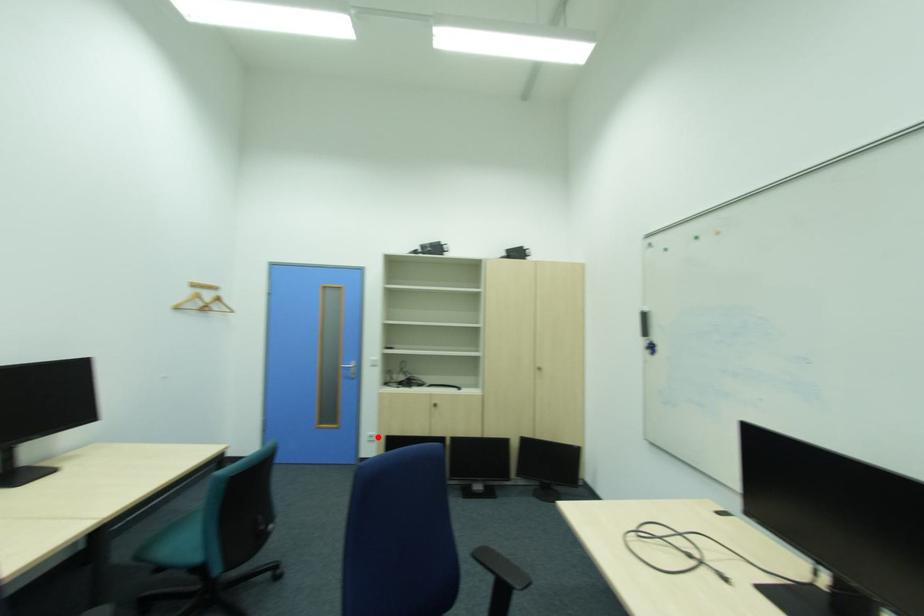
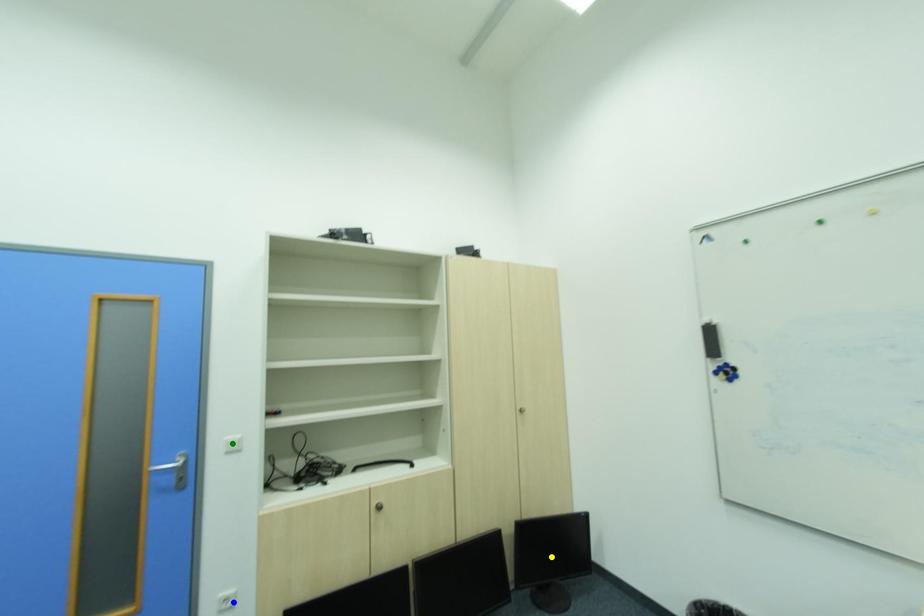
Question: I am providing you with two images of the same scene from different viewpoints. A red point is marked on the first image. You are given multiple points on the second image. Can you choose the point in image 2 that corresponds to the point in image 1?

Choices:
 (A) blue point
 (B) yellow point
 (C) green point

Answer: (A)